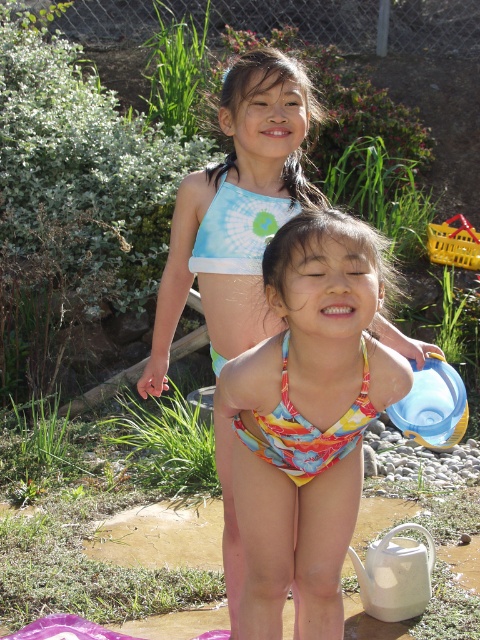
Does multicolored printed swimsuit at center have a lesser width compared to printed fabric bikini at center?

No, multicolored printed swimsuit at center is not thinner than printed fabric bikini at center.

Is multicolored printed swimsuit at center taller than printed fabric bikini at center?

Indeed, multicolored printed swimsuit at center has a greater height compared to printed fabric bikini at center.

Locate an element on the screen. The width and height of the screenshot is (480, 640). multicolored printed swimsuit at center is located at coordinates (237, 211).

The height and width of the screenshot is (640, 480). Identify the location of multicolored printed swimsuit at center. (237, 211).

Based on the photo, is multicolored fabric swimsuit at center shorter than multicolored printed swimsuit at center?

Incorrect, multicolored fabric swimsuit at center's height does not fall short of multicolored printed swimsuit at center's.

Can you confirm if multicolored fabric swimsuit at center is positioned below multicolored printed swimsuit at center?

Yes.

You are a GUI agent. You are given a task and a screenshot of the screen. Output one action in this format:
    pyautogui.click(x=<x>, y=<y>)
    Task: Click on the multicolored fabric swimsuit at center
    
    Given the screenshot: What is the action you would take?
    pyautogui.click(x=307, y=419)

The width and height of the screenshot is (480, 640). In order to click on multicolored fabric swimsuit at center in this screenshot , I will do `click(307, 419)`.

Is multicolored fabric swimsuit at center shorter than printed fabric bikini at center?

No.

Can you confirm if multicolored fabric swimsuit at center is positioned above printed fabric bikini at center?

Actually, multicolored fabric swimsuit at center is below printed fabric bikini at center.

Does point (315, 252) come in front of point (284, 416)?

Yes, it is in front of point (284, 416).

Identify the location of multicolored fabric swimsuit at center. This screenshot has width=480, height=640. (307, 419).